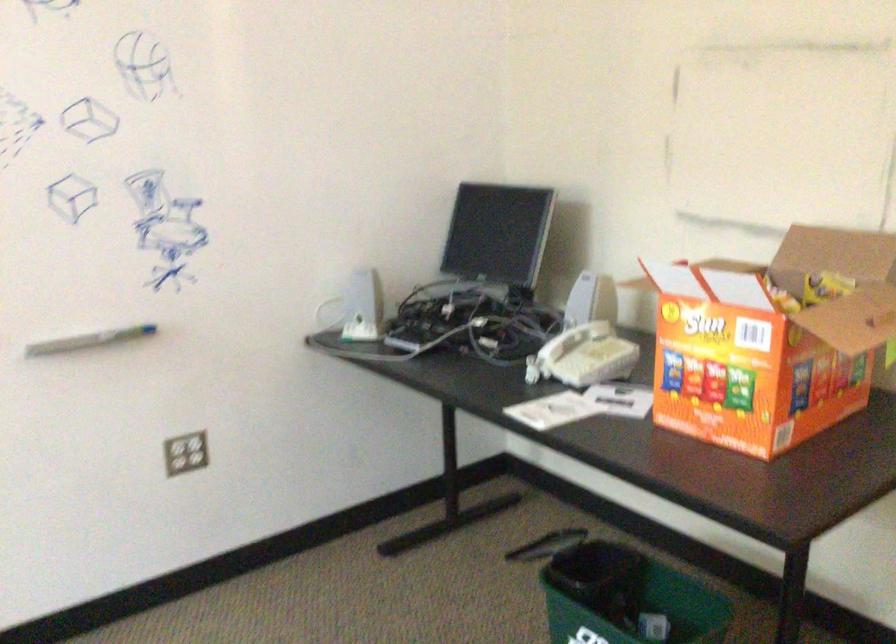
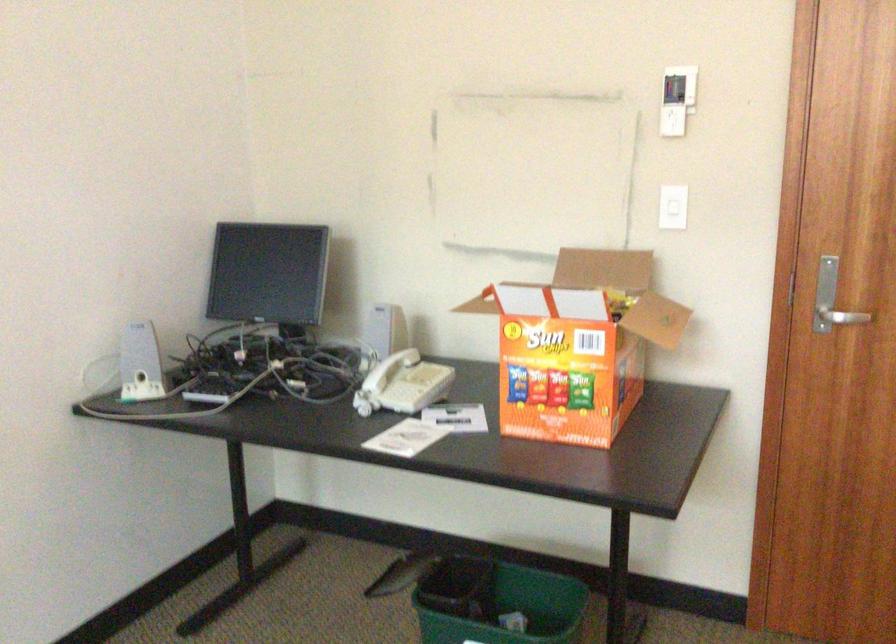
The point at (549,352) is marked in the first image. Where is the corresponding point in the second image?

(376, 383)